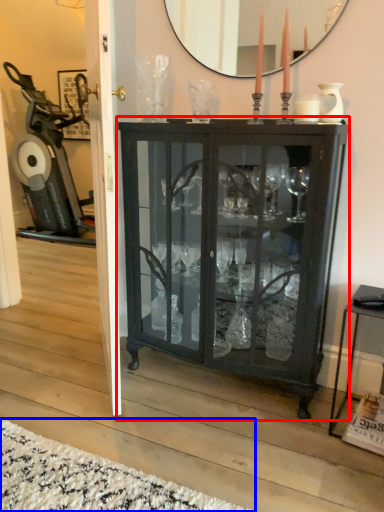
Question: Which object is closer to the camera taking this photo, cupboard (highlighted by a red box) or plain (highlighted by a blue box)?

Choices:
 (A) cupboard
 (B) plain

Answer: (B)